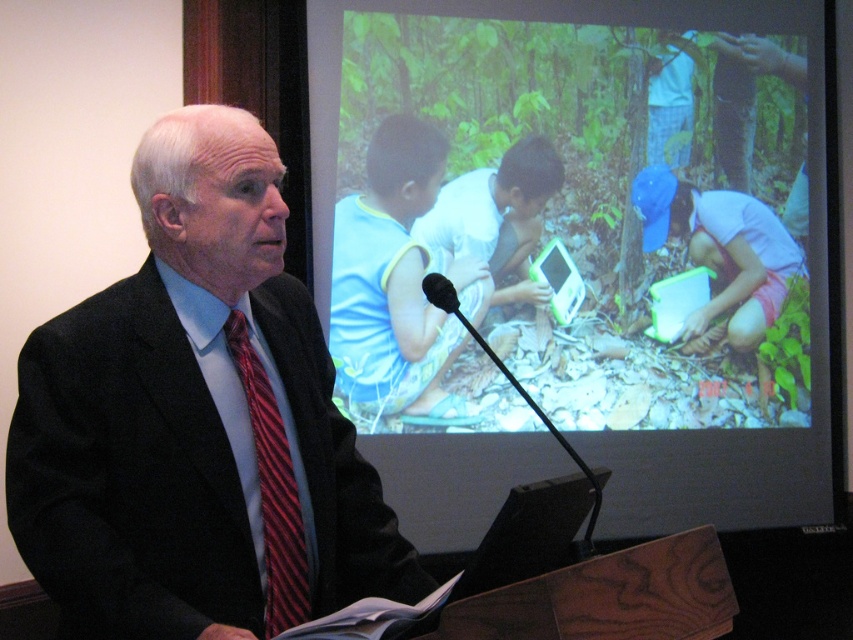
Does point (186, 424) come closer to viewer compared to point (590, 552)?

Yes.

Does black wool suit at left appear on the right side of black plastic microphone at center?

Incorrect, black wool suit at left is not on the right side of black plastic microphone at center.

This screenshot has width=853, height=640. Find the location of `black wool suit at left`. black wool suit at left is located at coordinates (196, 420).

At what (x,y) coordinates should I click in order to perform the action: click on black wool suit at left. Please return your answer as a coordinate pair (x, y). This screenshot has width=853, height=640. Looking at the image, I should click on (196, 420).

Can you confirm if white satin dress shirt at left is positioned below black plastic microphone at center?

Correct, white satin dress shirt at left is located below black plastic microphone at center.

Is the position of white satin dress shirt at left less distant than that of black plastic microphone at center?

That is False.

What are the coordinates of `white satin dress shirt at left` in the screenshot? It's located at (241, 404).

You are a GUI agent. You are given a task and a screenshot of the screen. Output one action in this format:
    pyautogui.click(x=<x>, y=<y>)
    Task: Click on the white satin dress shirt at left
    Image resolution: width=853 pixels, height=640 pixels.
    Given the screenshot: What is the action you would take?
    pyautogui.click(x=241, y=404)

Between white satin dress shirt at left and striped silk tie at left, which one appears on the right side from the viewer's perspective?

From the viewer's perspective, striped silk tie at left appears more on the right side.

Can you confirm if white satin dress shirt at left is bigger than striped silk tie at left?

Indeed, white satin dress shirt at left has a larger size compared to striped silk tie at left.

Who is more distant from viewer, (200, 355) or (281, 428)?

The point (281, 428) is behind.

Where is `white satin dress shirt at left`? The height and width of the screenshot is (640, 853). white satin dress shirt at left is located at coordinates (241, 404).